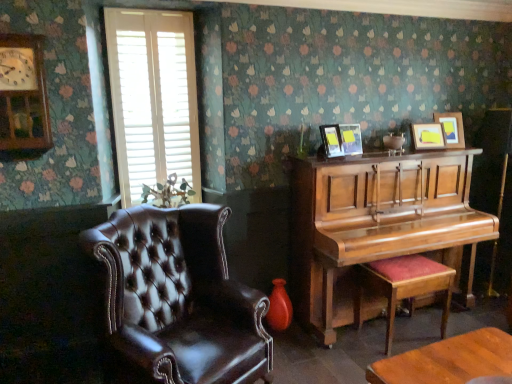
Question: From a real-world perspective, is wooden clock at upper left over white wood blinds at upper left?

Choices:
 (A) yes
 (B) no

Answer: (A)

Question: Is wooden clock at upper left behind white wood blinds at upper left?

Choices:
 (A) yes
 (B) no

Answer: (B)

Question: Is white wood blinds at upper left at the back of wooden clock at upper left?

Choices:
 (A) yes
 (B) no

Answer: (B)

Question: Does wooden clock at upper left turn towards white wood blinds at upper left?

Choices:
 (A) no
 (B) yes

Answer: (A)

Question: Does wooden clock at upper left appear on the right side of white wood blinds at upper left?

Choices:
 (A) yes
 (B) no

Answer: (B)

Question: From a real-world perspective, relative to wooden clock at upper left, is matte wooden picture frame at upper right, which ranks as the second picture frame in right-to-left order, vertically above or below?

Choices:
 (A) below
 (B) above

Answer: (A)

Question: Considering their positions, is matte wooden picture frame at upper right, placed as the third picture frame when sorted from left to right, located in front of or behind wooden clock at upper left?

Choices:
 (A) behind
 (B) front

Answer: (A)

Question: In terms of width, does matte wooden picture frame at upper right, which ranks as the second picture frame in right-to-left order, look wider or thinner when compared to wooden clock at upper left?

Choices:
 (A) thin
 (B) wide

Answer: (A)

Question: Considering the relative positions of matte wooden picture frame at upper right, placed as the third picture frame when sorted from left to right, and wooden clock at upper left in the image provided, is matte wooden picture frame at upper right, placed as the third picture frame when sorted from left to right, to the left or to the right of wooden clock at upper left?

Choices:
 (A) left
 (B) right

Answer: (B)

Question: Is wooden picture frame at upper right, the 4th picture frame in the left-to-right sequence, wider or thinner than matte wooden picture frame at upper right, which ranks as the second picture frame in right-to-left order?

Choices:
 (A) thin
 (B) wide

Answer: (B)

Question: Is wooden picture frame at upper right, marked as the 1th picture frame in a right-to-left arrangement, to the left or to the right of matte wooden picture frame at upper right, placed as the third picture frame when sorted from left to right, in the image?

Choices:
 (A) right
 (B) left

Answer: (A)

Question: Is wooden picture frame at upper right, marked as the 1th picture frame in a right-to-left arrangement, taller or shorter than matte wooden picture frame at upper right, placed as the third picture frame when sorted from left to right?

Choices:
 (A) short
 (B) tall

Answer: (B)

Question: From the image's perspective, is wooden picture frame at upper right, the 4th picture frame in the left-to-right sequence, located above or below matte wooden picture frame at upper right, which ranks as the second picture frame in right-to-left order?

Choices:
 (A) below
 (B) above

Answer: (B)

Question: From the image's perspective, is matte black picture frame at upper center, placed as the fourth picture frame when sorted from right to left, positioned above or below shiny brown piano at right?

Choices:
 (A) above
 (B) below

Answer: (A)

Question: Visually, is matte black picture frame at upper center, the first picture frame in the left-to-right sequence, positioned to the left or to the right of shiny brown piano at right?

Choices:
 (A) left
 (B) right

Answer: (A)